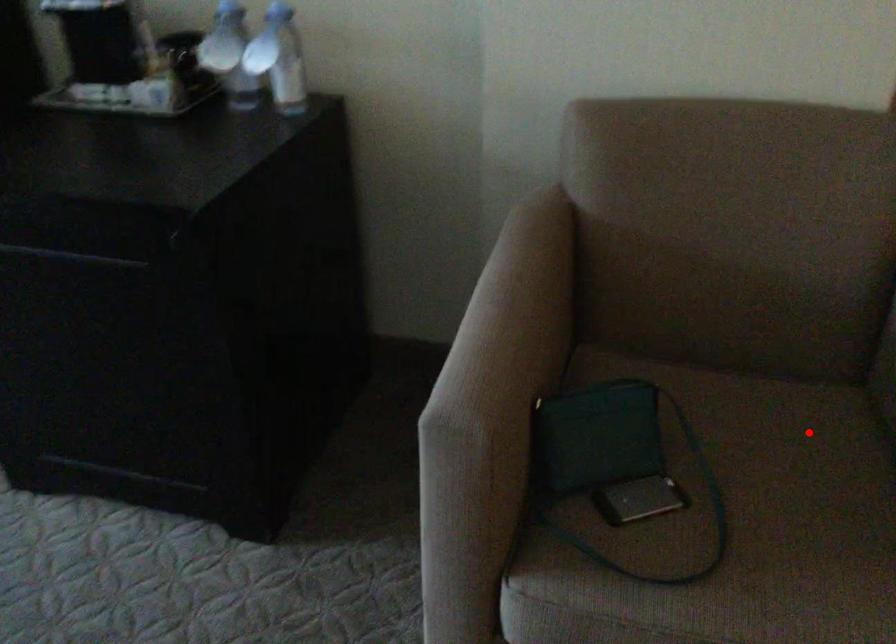
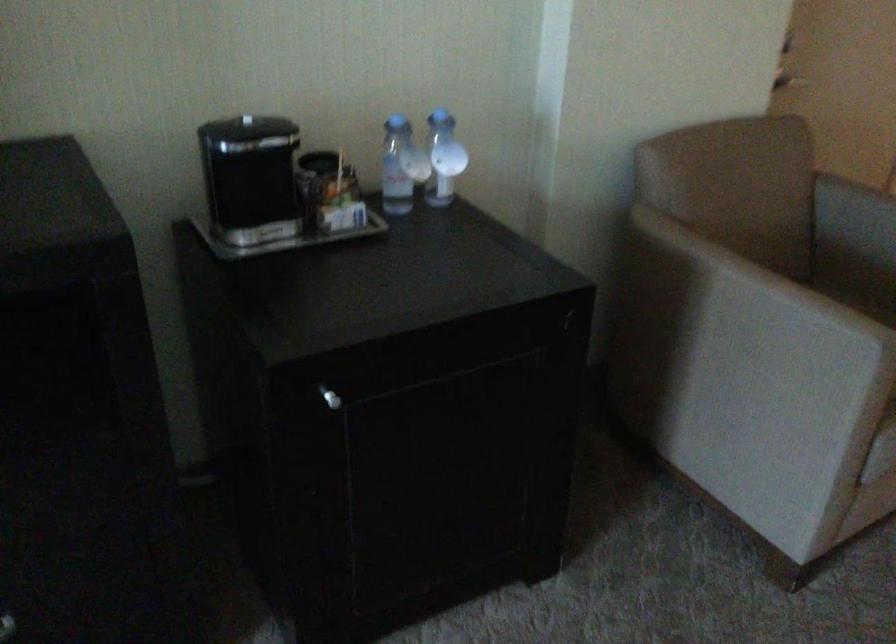
The point at the highlighted location is marked in the first image. Where is the corresponding point in the second image?

(859, 303)